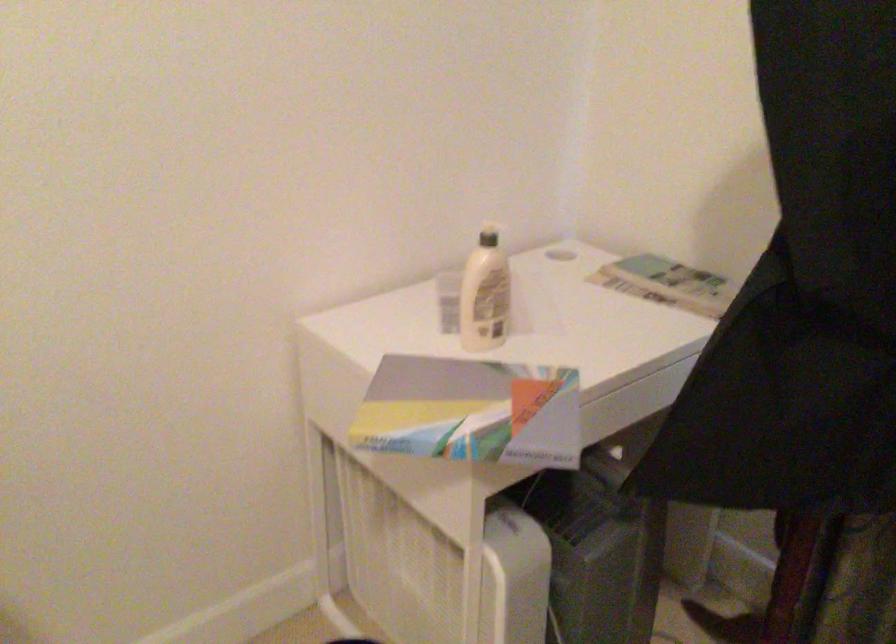
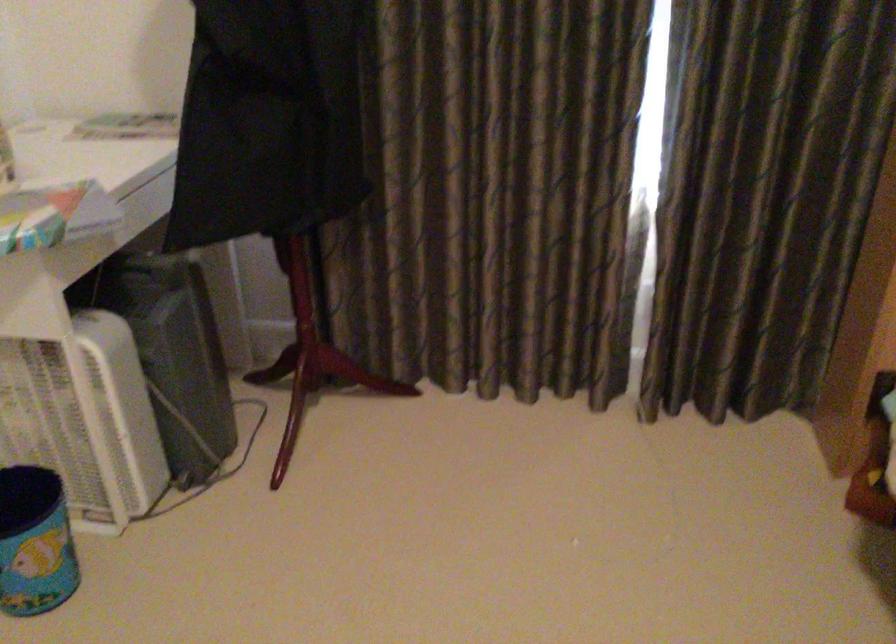
In the second image, find the point that corresponds to [496,422] in the first image.

(54, 214)